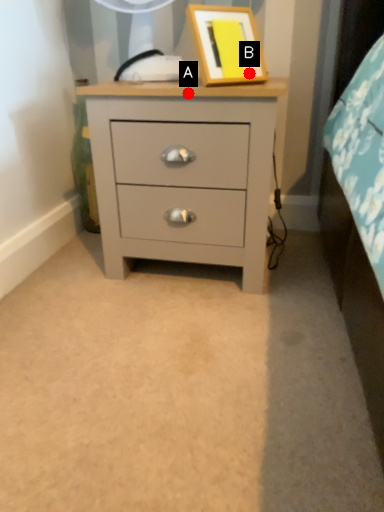
Question: Two points are circled on the image, labeled by A and B beside each circle. Which point is farther to the camera?

Choices:
 (A) A is further
 (B) B is further

Answer: (B)